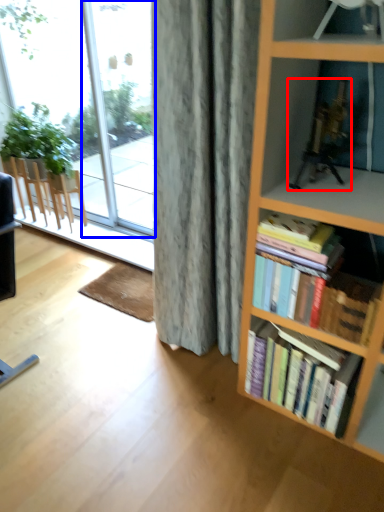
Question: Which of the following is the closest to the observer, toy (highlighted by a red box) or glass door (highlighted by a blue box)?

Choices:
 (A) toy
 (B) glass door

Answer: (A)